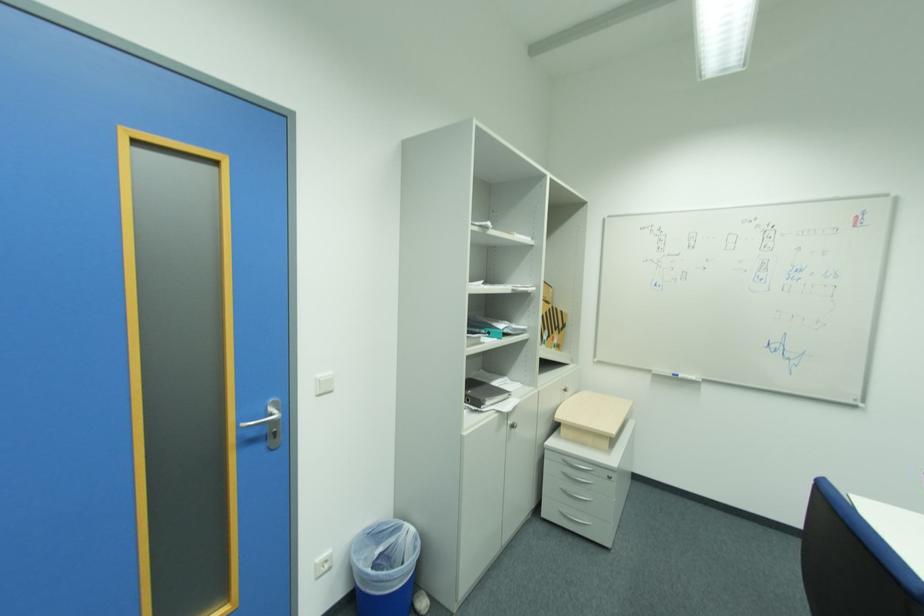
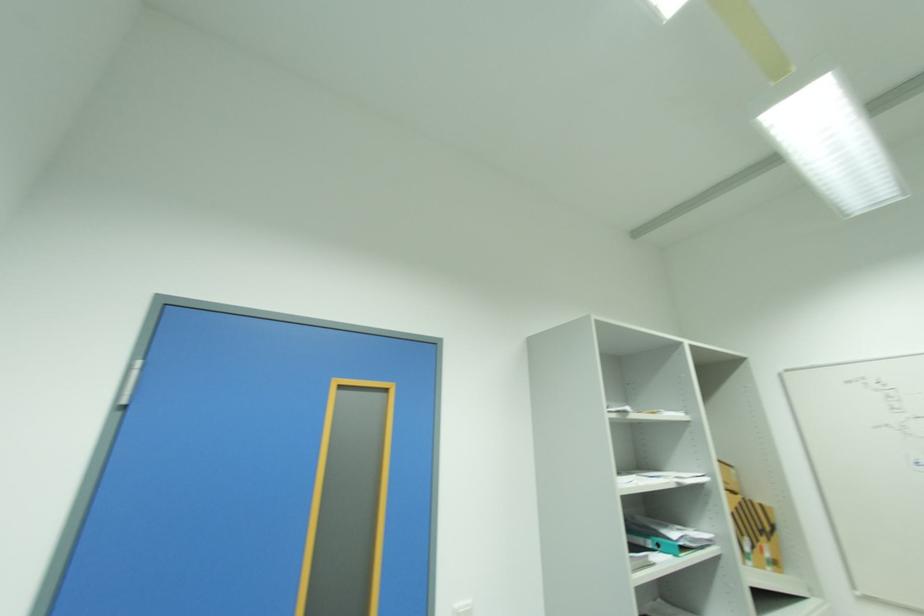
Where in the second image is the point corresponding to (323,377) from the first image?

(463, 604)